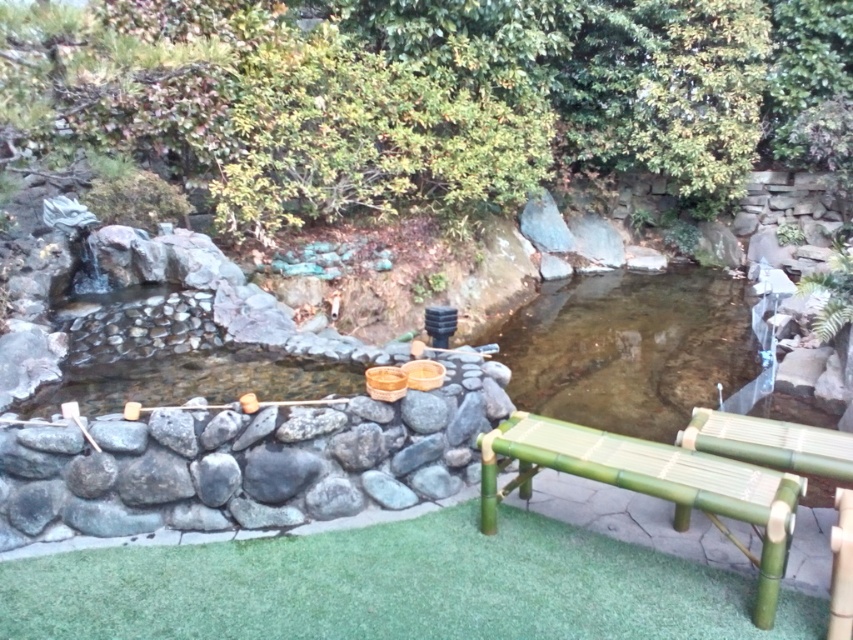
Question: Which point is farther to the camera?

Choices:
 (A) (520, 465)
 (B) (575, 412)

Answer: (B)

Question: Can you confirm if clear water at center is positioned above green bamboo bench at lower right?

Choices:
 (A) yes
 (B) no

Answer: (A)

Question: Can you confirm if clear water at center is smaller than green bamboo bench at lower right?

Choices:
 (A) no
 (B) yes

Answer: (A)

Question: Is clear water at center further to camera compared to green bamboo bench at lower right?

Choices:
 (A) no
 (B) yes

Answer: (B)

Question: Which point is closer to the camera?

Choices:
 (A) (636, 461)
 (B) (666, 372)

Answer: (A)